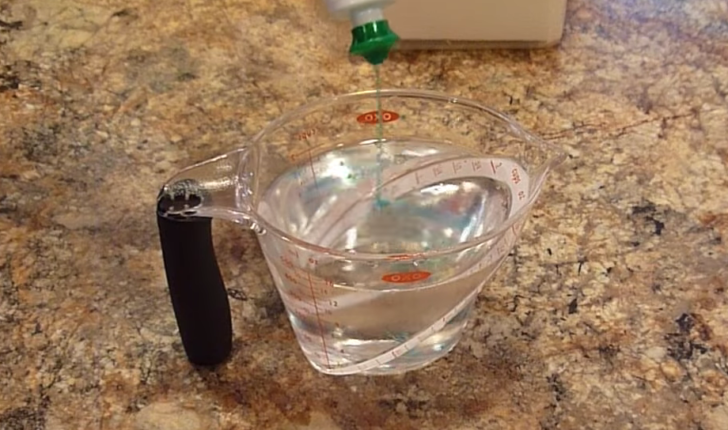
Locate an element on the screen. The height and width of the screenshot is (430, 728). dishwashing liquid is located at coordinates (376, 71).